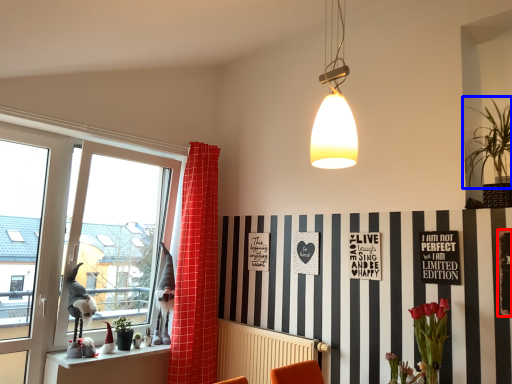
Question: Among these objects, which one is farthest to the camera, bulletin board (highlighted by a red box) or plant (highlighted by a blue box)?

Choices:
 (A) bulletin board
 (B) plant

Answer: (B)